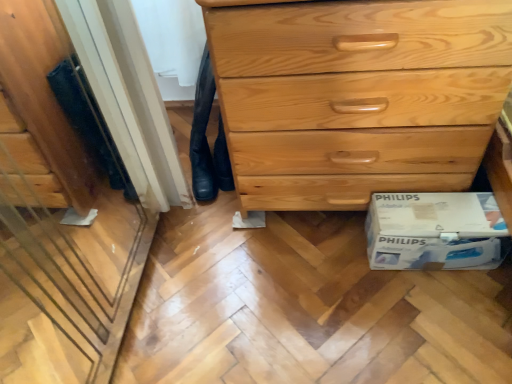
Question: From the image's perspective, relative to white cardboard box at lower right, is black leather jeans at lower center above or below?

Choices:
 (A) above
 (B) below

Answer: (A)

Question: Considering their positions, is black leather jeans at lower center located in front of or behind white cardboard box at lower right?

Choices:
 (A) behind
 (B) front

Answer: (A)

Question: Which object is the closest to the light wood chest of drawers at center?

Choices:
 (A) black leather jeans at lower center
 (B) white cardboard box at lower right

Answer: (B)

Question: Estimate the real-world distances between objects in this image. Which object is farther from the light wood chest of drawers at center?

Choices:
 (A) white cardboard box at lower right
 (B) black leather jeans at lower center

Answer: (B)